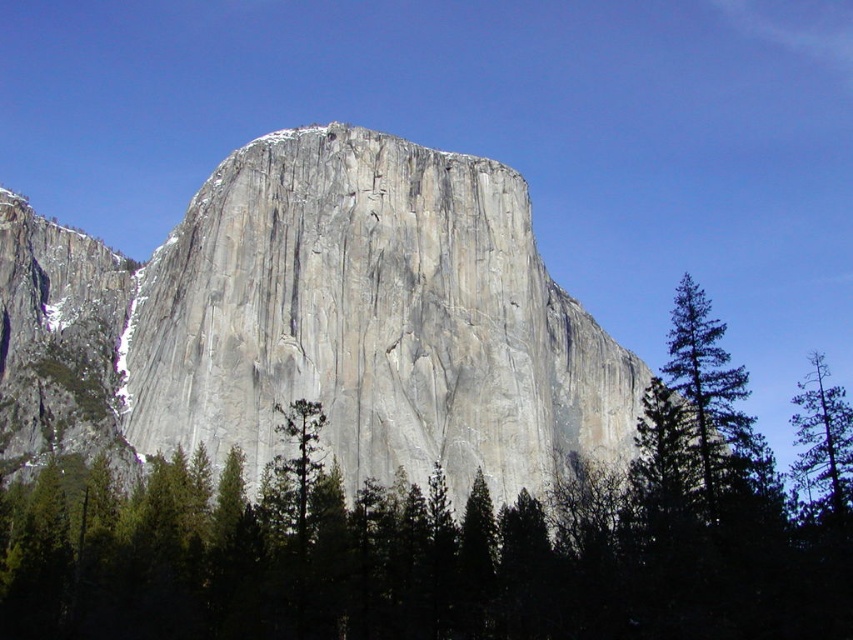
Who is positioned more to the left, gray rock formation at center or green textured tree at right?

From the viewer's perspective, gray rock formation at center appears more on the left side.

The width and height of the screenshot is (853, 640). Describe the element at coordinates (318, 323) in the screenshot. I see `gray rock formation at center` at that location.

Where is `gray rock formation at center`? This screenshot has height=640, width=853. gray rock formation at center is located at coordinates (318, 323).

Can you confirm if green coniferous tree at right is positioned below green textured tree at right?

No, green coniferous tree at right is not below green textured tree at right.

Can you confirm if green coniferous tree at right is positioned to the right of green textured tree at right?

No, green coniferous tree at right is not to the right of green textured tree at right.

What are the coordinates of `green coniferous tree at right` in the screenshot? It's located at (708, 388).

Is gray rock formation at center positioned before green coniferous tree at right?

That is False.

Is gray rock formation at center further to camera compared to green coniferous tree at right?

Yes.

At what (x,y) coordinates should I click in order to perform the action: click on gray rock formation at center. Please return your answer as a coordinate pair (x, y). This screenshot has width=853, height=640. Looking at the image, I should click on (318, 323).

Where is `gray rock formation at center`? This screenshot has height=640, width=853. gray rock formation at center is located at coordinates click(x=318, y=323).